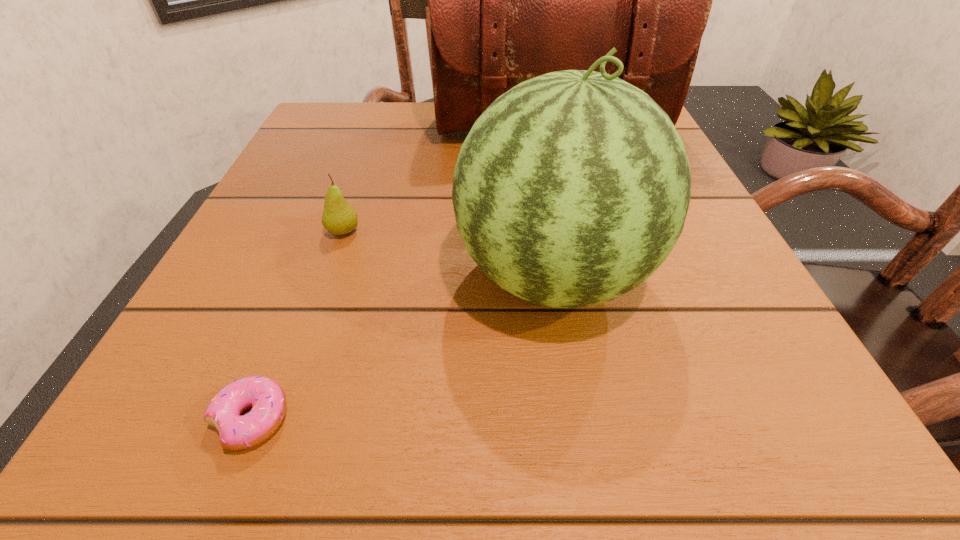
Find the location of `object that is at the near edge`. object that is at the near edge is located at coordinates (267, 399).

The height and width of the screenshot is (540, 960). Identify the location of pear at the left edge. (339, 217).

Locate an element on the screen. The image size is (960, 540). doughnut positioned at the left edge is located at coordinates (267, 399).

Where is `satchel located at the right edge`? This screenshot has width=960, height=540. satchel located at the right edge is located at coordinates (509, 0).

Where is `watermelon that is at the right edge`? watermelon that is at the right edge is located at coordinates (572, 188).

Image resolution: width=960 pixels, height=540 pixels. Find the location of `object that is at the near left corner`. object that is at the near left corner is located at coordinates (267, 399).

Locate an element on the screen. The width and height of the screenshot is (960, 540). object at the far right corner is located at coordinates (509, 0).

The height and width of the screenshot is (540, 960). I want to click on free space at the far edge of the desktop, so pyautogui.click(x=450, y=139).

In the image, there is a desktop. Identify the location of vacant space at the near edge. (450, 398).

Locate an element on the screen. free region at the left edge of the desktop is located at coordinates (323, 278).